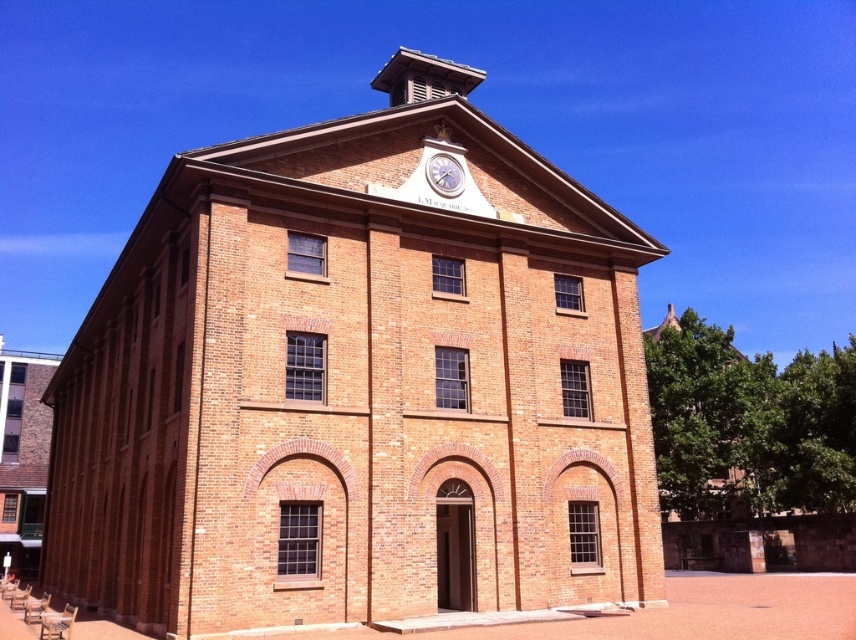
From the picture: You are standing in front of the brown brick building at center and notice the metallic silver clock at center. Which object is positioned higher from the ground?

The metallic silver clock at center is positioned higher from the ground than the brown brick building at center.

You are standing at point (358, 384) in the image. What is the object located at this point?

The object at point (358, 384) is the brown brick building at center.